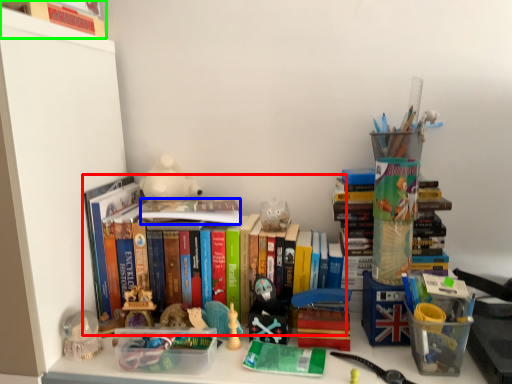
Question: Which is nearer to the book (highlighted by a red box)? book (highlighted by a blue box) or book (highlighted by a green box).

Choices:
 (A) book
 (B) book

Answer: (A)